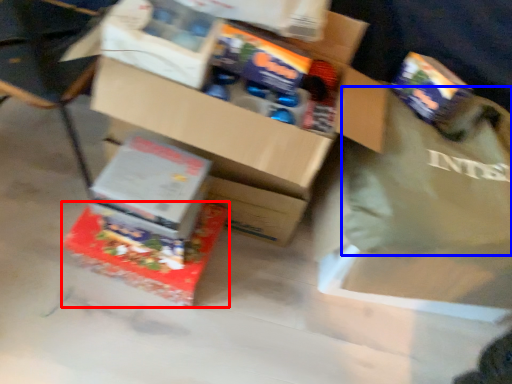
Question: Which of the following is the closest to the observer, box (highlighted by a red box) or tote bag (highlighted by a blue box)?

Choices:
 (A) box
 (B) tote bag

Answer: (B)